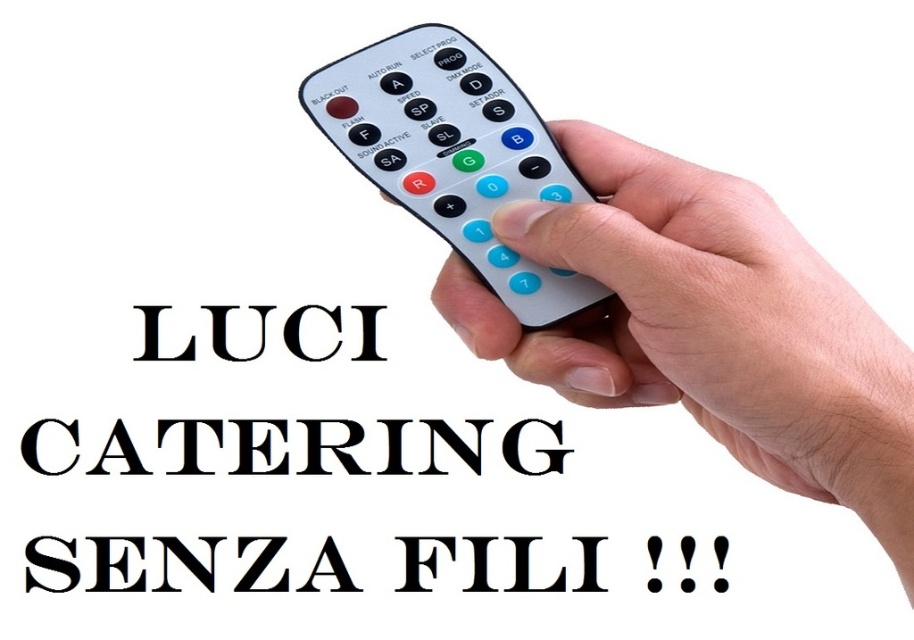
Question: Does white matte remote control at center lie in front of white plastic remote at center?

Choices:
 (A) no
 (B) yes

Answer: (B)

Question: Among these objects, which one is farthest from the camera?

Choices:
 (A) black matte catering at center
 (B) black paper text at center
 (C) black solid text at center

Answer: (C)

Question: Does white matte remote control at center appear on the left side of white plastic remote at center?

Choices:
 (A) yes
 (B) no

Answer: (B)

Question: Which of the following is the farthest from the observer?

Choices:
 (A) black matte catering at center
 (B) black solid text at center

Answer: (B)

Question: Where is white plastic remote at center located in relation to black matte catering at center in the image?

Choices:
 (A) below
 (B) above

Answer: (B)

Question: Among these points, which one is farthest from the camera?

Choices:
 (A) (449, 241)
 (B) (470, 561)
 (C) (30, 460)

Answer: (B)